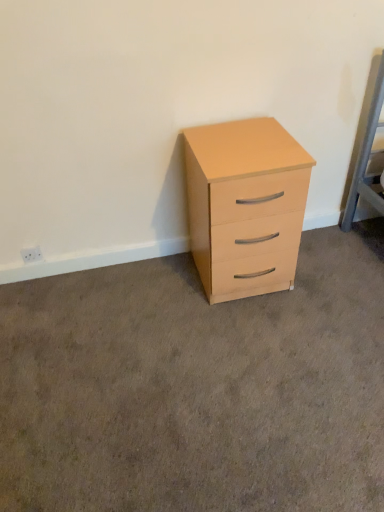
The width and height of the screenshot is (384, 512). Find the location of `free location in front of light wood/finish chest of drawers at center`. free location in front of light wood/finish chest of drawers at center is located at coordinates (252, 336).